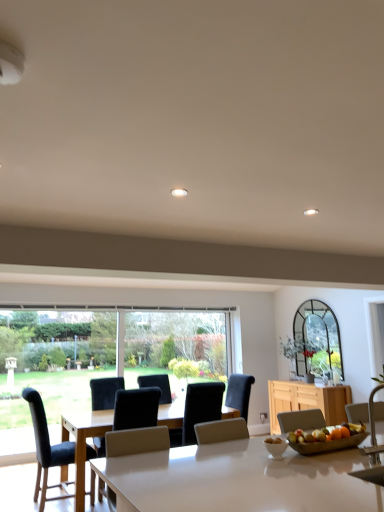
Question: Is white glossy table at center positioned before white glossy bowl at center?

Choices:
 (A) no
 (B) yes

Answer: (B)

Question: Is white glossy table at center to the right of white glossy bowl at center from the viewer's perspective?

Choices:
 (A) no
 (B) yes

Answer: (B)

Question: Is white glossy table at center not inside white glossy bowl at center?

Choices:
 (A) no
 (B) yes

Answer: (B)

Question: From the image's perspective, is white glossy table at center over white glossy bowl at center?

Choices:
 (A) yes
 (B) no

Answer: (B)

Question: Is white glossy table at center oriented away from white glossy bowl at center?

Choices:
 (A) yes
 (B) no

Answer: (B)

Question: Considering the positions of wooden cabinet at right and metallic silver chair at right, the fourth chair when ordered from left to right, in the image, is wooden cabinet at right wider or thinner than metallic silver chair at right, the fourth chair when ordered from left to right,?

Choices:
 (A) thin
 (B) wide

Answer: (B)

Question: Is wooden cabinet at right in front of or behind metallic silver chair at right, which appears as the 1th chair when viewed from the front, in the image?

Choices:
 (A) behind
 (B) front

Answer: (A)

Question: Based on their sizes in the image, would you say wooden cabinet at right is bigger or smaller than metallic silver chair at right, the fourth chair when ordered from left to right?

Choices:
 (A) small
 (B) big

Answer: (B)

Question: From the image's perspective, is wooden cabinet at right positioned above or below metallic silver chair at right, which is the first chair in right-to-left order?

Choices:
 (A) below
 (B) above

Answer: (A)

Question: From a real-world perspective, is white glossy bowl at center physically located above or below black leather chair at center, the 4th chair positioned from the front?

Choices:
 (A) below
 (B) above

Answer: (B)

Question: Is white glossy bowl at center taller or shorter than black leather chair at center, positioned as the 1th chair in back-to-front order?

Choices:
 (A) short
 (B) tall

Answer: (A)

Question: Visually, is white glossy bowl at center positioned to the left or to the right of black leather chair at center, which is counted as the 3th chair, starting from the left?

Choices:
 (A) left
 (B) right

Answer: (B)

Question: Is white glossy bowl at center wider or thinner than black leather chair at center, the second chair in the right-to-left sequence?

Choices:
 (A) thin
 (B) wide

Answer: (A)

Question: Visually, is metallic silver chair at right, which appears as the 1th chair when viewed from the front, positioned to the left or to the right of velvet black chair at center, which is counted as the 2th chair, starting from the front?

Choices:
 (A) left
 (B) right

Answer: (B)

Question: Considering their positions, is metallic silver chair at right, which appears as the 1th chair when viewed from the front, located in front of or behind velvet black chair at center, which is the 2th chair in left-to-right order?

Choices:
 (A) front
 (B) behind

Answer: (A)